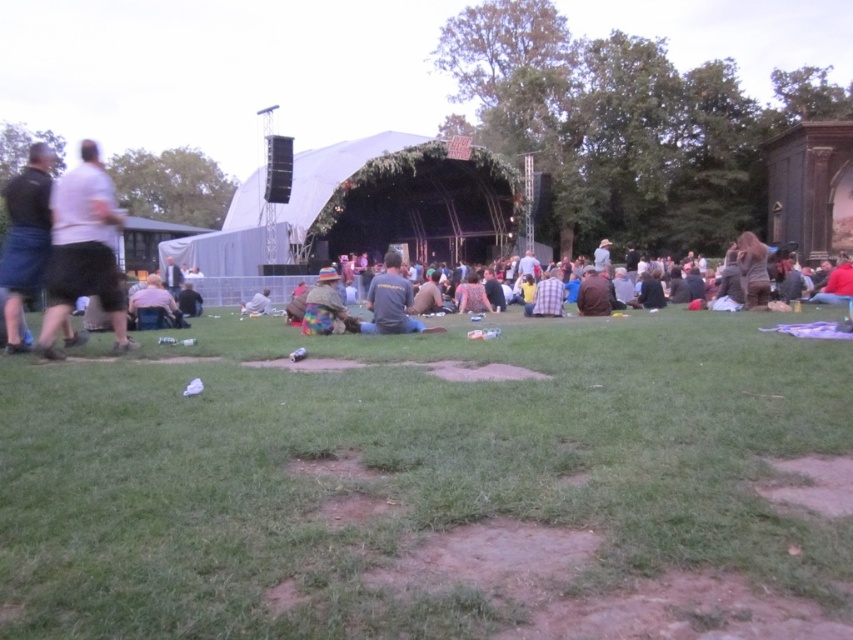
Does light gray cotton shorts at left have a lesser width compared to dark gray t-shirt at center?

Incorrect, light gray cotton shorts at left's width is not less than dark gray t-shirt at center's.

Which is behind, point (42, 339) or point (405, 289)?

The point (405, 289) is behind.

Which is behind, point (91, 189) or point (361, 326)?

Positioned behind is point (361, 326).

Find the location of `light gray cotton shorts at left`. light gray cotton shorts at left is located at coordinates (83, 250).

Is point (84, 182) positioned behind point (260, 292)?

No, it is not.

Who is more distant from viewer, (55, 186) or (265, 307)?

The point (265, 307) is more distant.

Which is in front, point (50, 282) or point (250, 301)?

Point (50, 282) is in front.

Where is `light gray cotton shorts at left`? light gray cotton shorts at left is located at coordinates (x=83, y=250).

Is plaid shirt at center thinner than camouflage-patterned jacket at center?

No.

I want to click on plaid shirt at center, so (548, 296).

The height and width of the screenshot is (640, 853). Describe the element at coordinates (548, 296) in the screenshot. I see `plaid shirt at center` at that location.

The width and height of the screenshot is (853, 640). I want to click on plaid shirt at center, so click(548, 296).